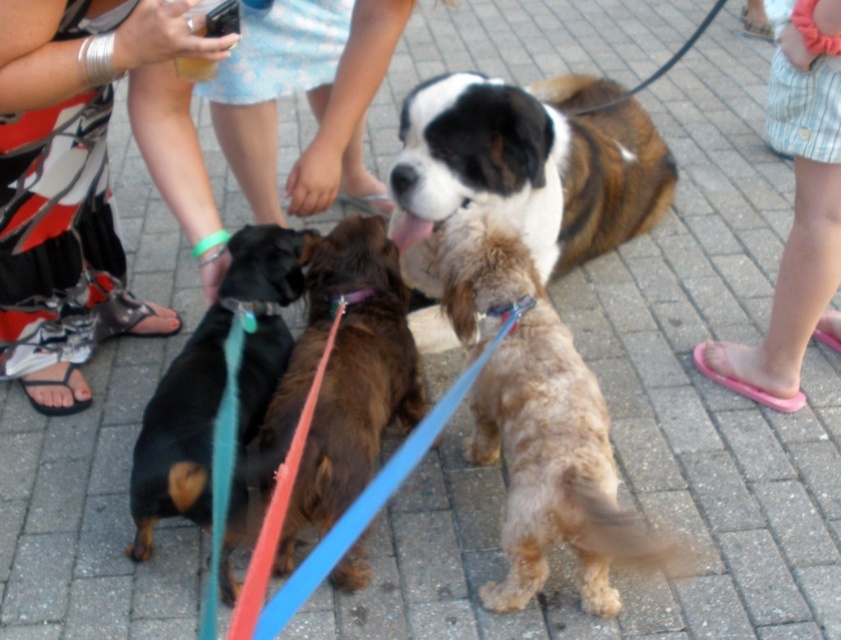
You are standing at the center of the paved area in the dog park. There are two points marked on the ground in front of you. One is at coordinates point [36,161] and the other is at point [818,120]. Which point is closer to you?

Point [36,161] is closer to the viewer than point [818,120].

You are standing at the center of the paved area and want to find your metallic silver sandals at lower left. According to the scene description, where exactly are the metallic silver sandals located in relation to the dogs?

The metallic silver sandals at lower left are located at point coordinates (83, 177), which places them near the lower left corner of the scene, away from the dogs positioned in the foreground.